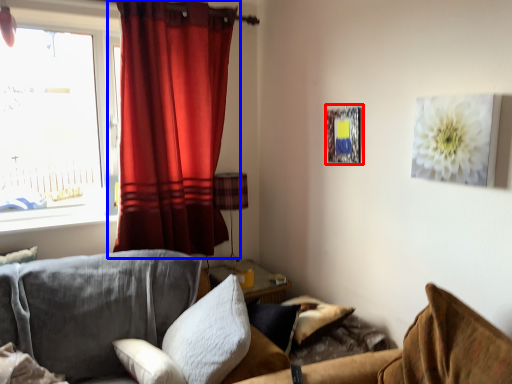
Question: Which object appears closest to the camera in this image, picture frame (highlighted by a red box) or curtain (highlighted by a blue box)?

Choices:
 (A) picture frame
 (B) curtain

Answer: (A)